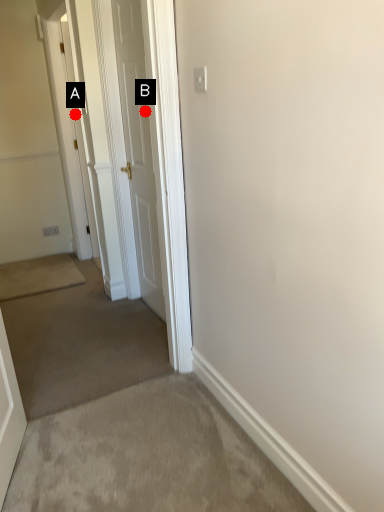
Question: Two points are circled on the image, labeled by A and B beside each circle. Which point is farther to the camera?

Choices:
 (A) A is further
 (B) B is further

Answer: (A)